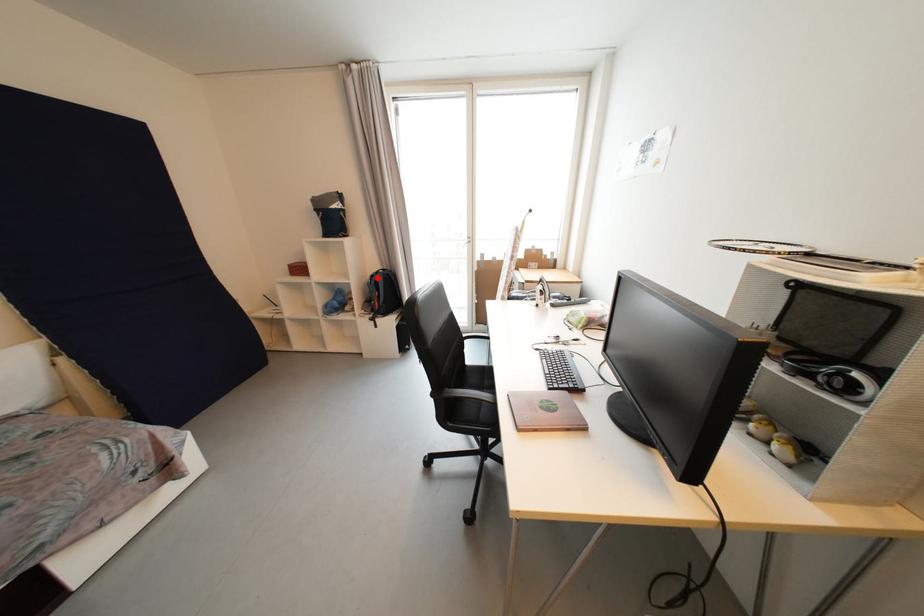
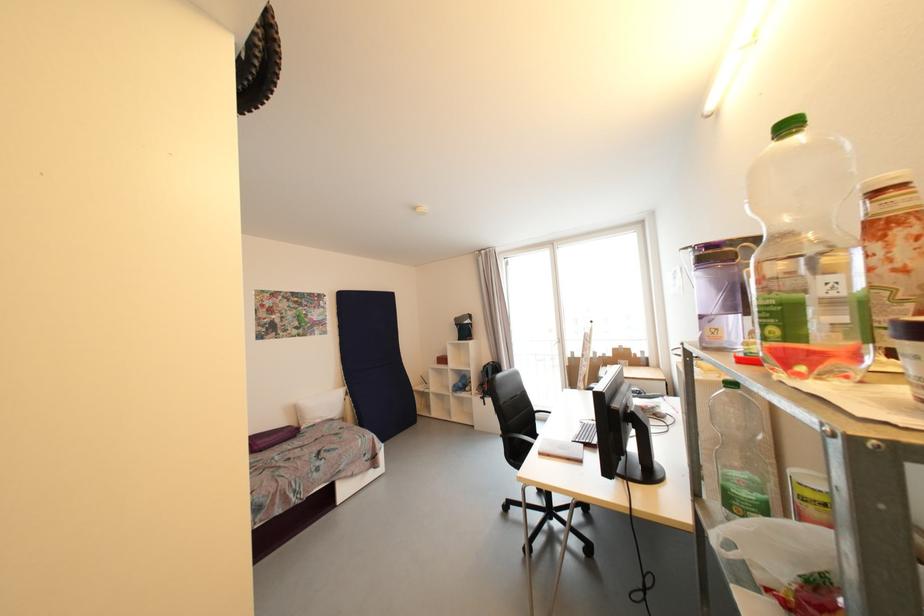
Question: I am providing you with two images of the same scene from different viewpoints. A red point is marked on the first image. Is the red point's position out of view in image 2?

Choices:
 (A) Yes
 (B) No

Answer: (B)